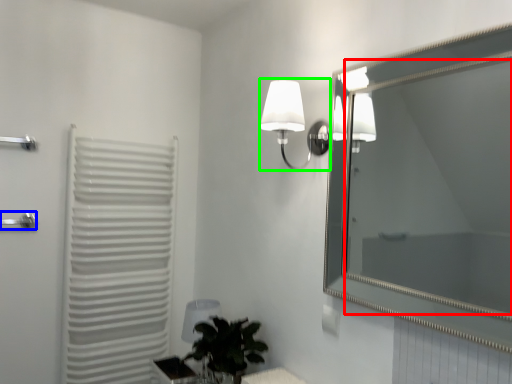
Question: Which object is the closest to the mirror (highlighted by a red box)? Choose among these: shower (highlighted by a blue box) or lamp (highlighted by a green box).

Choices:
 (A) shower
 (B) lamp

Answer: (B)